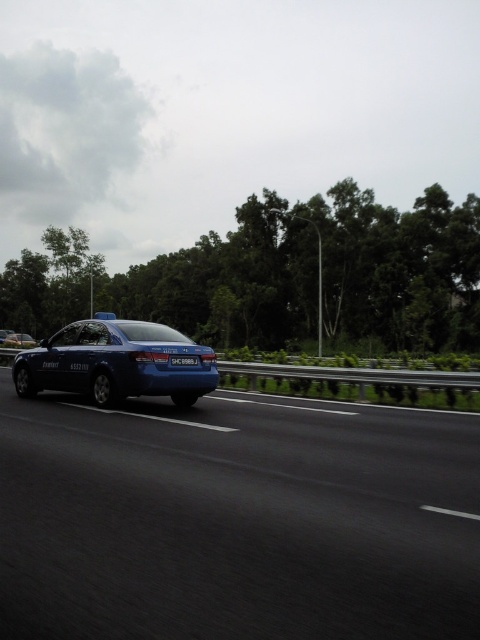
Which of these two, matte blue sedan at left or blue glossy sedan at left, stands shorter?

blue glossy sedan at left

In order to click on matte blue sedan at left in this screenshot , I will do `click(116, 362)`.

This screenshot has width=480, height=640. In order to click on matte blue sedan at left in this screenshot , I will do `click(116, 362)`.

Consider the image. Does matte blue sedan at left have a larger size compared to blue metallic car at left?

No.

This screenshot has height=640, width=480. Describe the element at coordinates (116, 362) in the screenshot. I see `matte blue sedan at left` at that location.

Find the location of a particular element. This screenshot has width=480, height=640. matte blue sedan at left is located at coordinates (116, 362).

Does blue glossy car at center appear under matte blue sedan at left?

Yes, blue glossy car at center is below matte blue sedan at left.

Consider the image. Between blue glossy car at center and matte blue sedan at left, which one has less height?

Standing shorter between the two is blue glossy car at center.

Is point (118, 493) positioned after point (95, 378)?

No, (118, 493) is closer to viewer.

Find the location of a particular element. The width and height of the screenshot is (480, 640). blue glossy car at center is located at coordinates (236, 518).